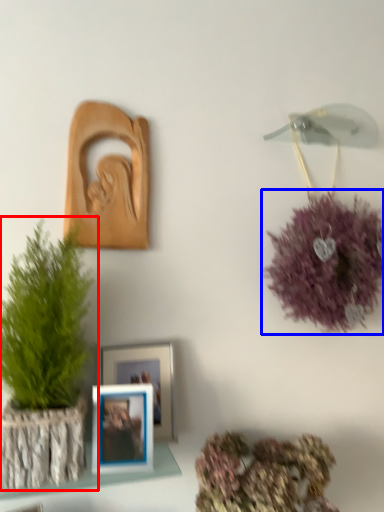
Question: Which point is closer to the camera, houseplant (highlighted by a red box) or flower (highlighted by a blue box)?

Choices:
 (A) houseplant
 (B) flower

Answer: (A)